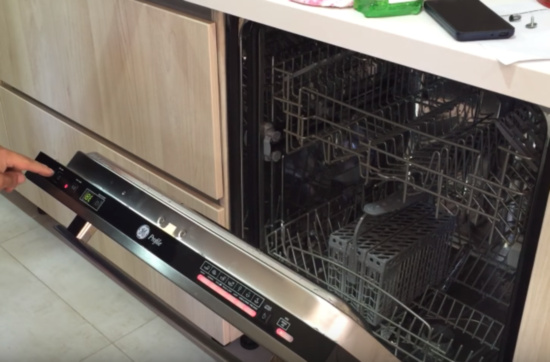
Identify the location of door of dishwasher. (130, 266).